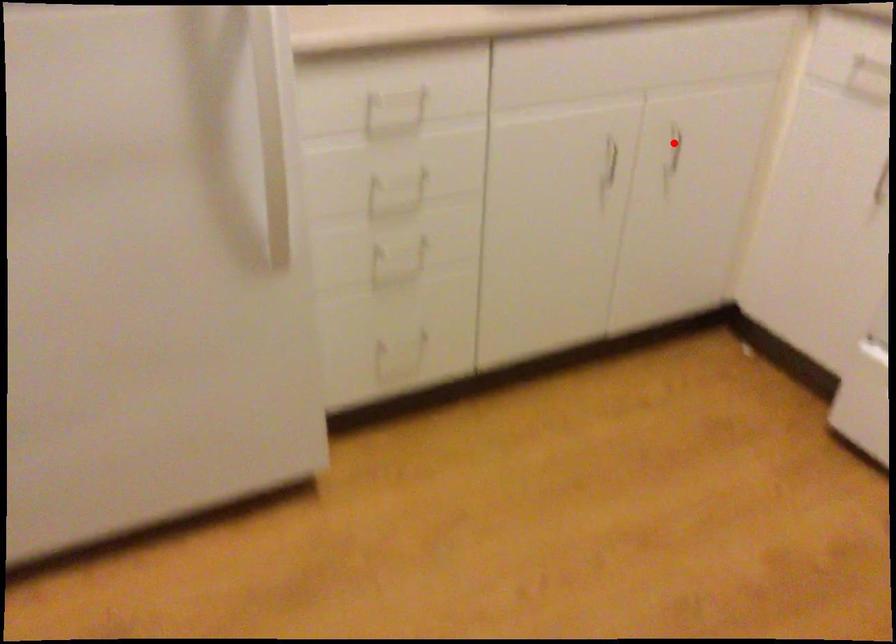
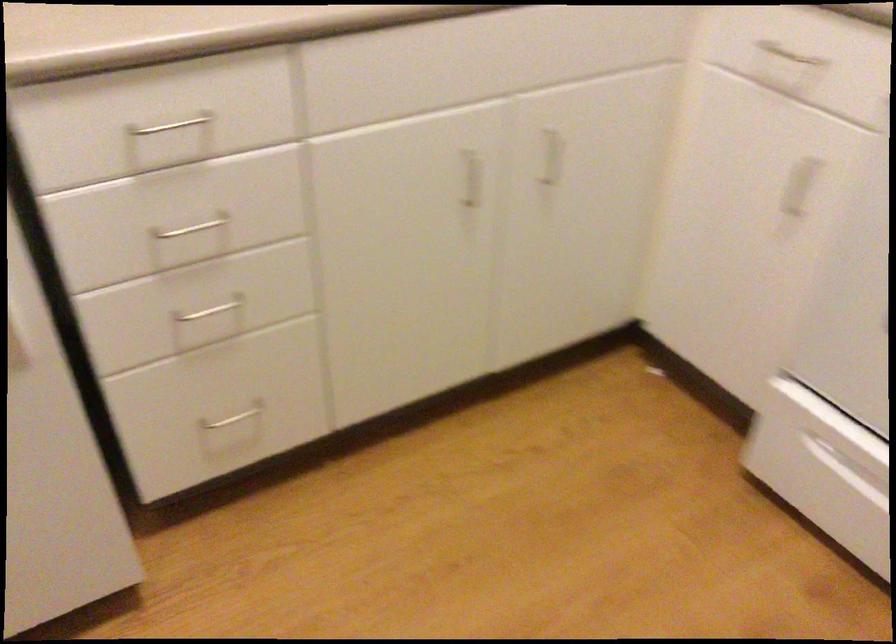
The point at the highlighted location is marked in the first image. Where is the corresponding point in the second image?

(552, 156)